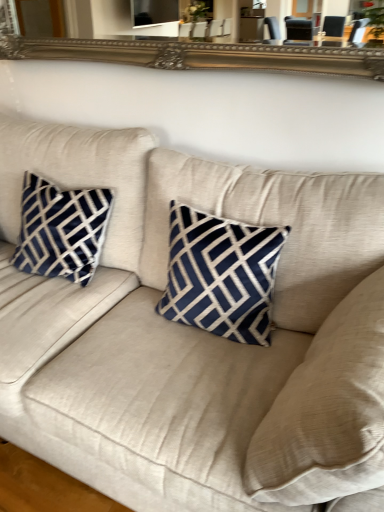
Question: Should I look upward or downward to see navy blue velvet pillow at left?

Choices:
 (A) up
 (B) down

Answer: (A)